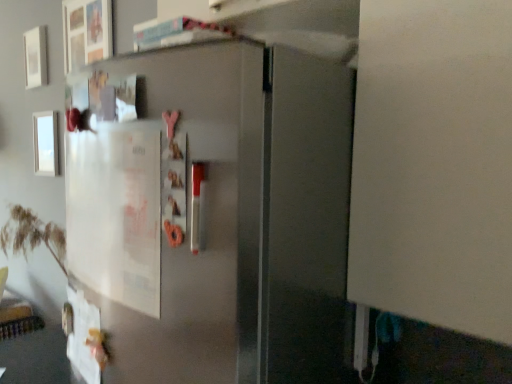
In order to click on white matte picture frame at upper left, positioned as the second picture frame in bottom-to-top order in this screenshot , I will do `click(35, 57)`.

Image resolution: width=512 pixels, height=384 pixels. What do you see at coordinates (35, 57) in the screenshot? I see `white matte picture frame at upper left, which appears as the 1th picture frame when viewed from the top` at bounding box center [35, 57].

What is the approximate width of white glossy picture frame at upper left, the first picture frame from the bottom?

The width of white glossy picture frame at upper left, the first picture frame from the bottom, is 1.33 inches.

At what (x,y) coordinates should I click in order to perform the action: click on white glossy picture frame at upper left, the first picture frame from the bottom. Please return your answer as a coordinate pair (x, y). Image resolution: width=512 pixels, height=384 pixels. Looking at the image, I should click on (45, 143).

Describe the element at coordinates (45, 143) in the screenshot. I see `white glossy picture frame at upper left, the first picture frame from the bottom` at that location.

Image resolution: width=512 pixels, height=384 pixels. Find the location of `white matte picture frame at upper left, positioned as the second picture frame in bottom-to-top order`. white matte picture frame at upper left, positioned as the second picture frame in bottom-to-top order is located at coordinates (35, 57).

Can you confirm if white matte picture frame at upper left, positioned as the second picture frame in bottom-to-top order, is positioned to the right of white glossy picture frame at upper left, the first picture frame from the bottom?

No, white matte picture frame at upper left, positioned as the second picture frame in bottom-to-top order, is not to the right of white glossy picture frame at upper left, the first picture frame from the bottom.

Which object is closer to the camera, white matte picture frame at upper left, positioned as the second picture frame in bottom-to-top order, or white glossy picture frame at upper left, the first picture frame from the bottom?

white glossy picture frame at upper left, the first picture frame from the bottom.

Considering the points (30, 84) and (55, 126), which point is in front, point (30, 84) or point (55, 126)?

The point (55, 126) is closer.

From the image's perspective, who appears lower, white matte picture frame at upper left, positioned as the second picture frame in bottom-to-top order, or white glossy picture frame at upper left, the first picture frame from the bottom?

white glossy picture frame at upper left, the first picture frame from the bottom, is shown below in the image.

From a real-world perspective, who is located higher, white matte picture frame at upper left, positioned as the second picture frame in bottom-to-top order, or white glossy picture frame at upper left, the first picture frame from the bottom?

white matte picture frame at upper left, positioned as the second picture frame in bottom-to-top order.

Can you confirm if white matte picture frame at upper left, positioned as the second picture frame in bottom-to-top order, is wider than white glossy picture frame at upper left, the first picture frame from the bottom?

Yes.

In terms of height, does white matte picture frame at upper left, positioned as the second picture frame in bottom-to-top order, look taller or shorter compared to white glossy picture frame at upper left, which appears as the second picture frame when viewed from the top?

In the image, white matte picture frame at upper left, positioned as the second picture frame in bottom-to-top order, appears to be shorter than white glossy picture frame at upper left, which appears as the second picture frame when viewed from the top.

Looking at this image, which of these two, white matte picture frame at upper left, which appears as the 1th picture frame when viewed from the top, or white glossy picture frame at upper left, which appears as the second picture frame when viewed from the top, is smaller?

Smaller between the two is white glossy picture frame at upper left, which appears as the second picture frame when viewed from the top.

Based on the photo, is white matte picture frame at upper left, positioned as the second picture frame in bottom-to-top order, inside or outside of white glossy picture frame at upper left, the first picture frame from the bottom?

white matte picture frame at upper left, positioned as the second picture frame in bottom-to-top order, is not enclosed by white glossy picture frame at upper left, the first picture frame from the bottom.

Are white matte picture frame at upper left, positioned as the second picture frame in bottom-to-top order, and white glossy picture frame at upper left, the first picture frame from the bottom, making contact?

No, white matte picture frame at upper left, positioned as the second picture frame in bottom-to-top order, is not in contact with white glossy picture frame at upper left, the first picture frame from the bottom.

Is white matte picture frame at upper left, positioned as the second picture frame in bottom-to-top order, looking in the opposite direction of white glossy picture frame at upper left, the first picture frame from the bottom?

That's not correct — white matte picture frame at upper left, positioned as the second picture frame in bottom-to-top order, is not looking away from white glossy picture frame at upper left, the first picture frame from the bottom.

Where is `picture frame that is below the white matte picture frame at upper left, which appears as the 1th picture frame when viewed from the top (from the image's perspective)`? The image size is (512, 384). picture frame that is below the white matte picture frame at upper left, which appears as the 1th picture frame when viewed from the top (from the image's perspective) is located at coordinates (45, 143).

In the image, is white glossy picture frame at upper left, which appears as the second picture frame when viewed from the top, on the left side or the right side of white matte picture frame at upper left, positioned as the second picture frame in bottom-to-top order?

white glossy picture frame at upper left, which appears as the second picture frame when viewed from the top, is positioned on white matte picture frame at upper left, positioned as the second picture frame in bottom-to-top order,'s right side.

Considering the positions of objects white glossy picture frame at upper left, which appears as the second picture frame when viewed from the top, and white matte picture frame at upper left, which appears as the 1th picture frame when viewed from the top, in the image provided, who is behind, white glossy picture frame at upper left, which appears as the second picture frame when viewed from the top, or white matte picture frame at upper left, which appears as the 1th picture frame when viewed from the top,?

white matte picture frame at upper left, which appears as the 1th picture frame when viewed from the top, is further from the camera.

Is point (41, 122) positioned before point (28, 40)?

That is False.

From the image's perspective, which one is positioned higher, white glossy picture frame at upper left, which appears as the second picture frame when viewed from the top, or white matte picture frame at upper left, positioned as the second picture frame in bottom-to-top order?

white matte picture frame at upper left, positioned as the second picture frame in bottom-to-top order, is shown above in the image.

From a real-world perspective, is white glossy picture frame at upper left, which appears as the second picture frame when viewed from the top, beneath white matte picture frame at upper left, positioned as the second picture frame in bottom-to-top order?

Yes, from a real-world perspective, white glossy picture frame at upper left, which appears as the second picture frame when viewed from the top, is under white matte picture frame at upper left, positioned as the second picture frame in bottom-to-top order.

Is white glossy picture frame at upper left, which appears as the second picture frame when viewed from the top, wider than white matte picture frame at upper left, positioned as the second picture frame in bottom-to-top order?

Incorrect, the width of white glossy picture frame at upper left, which appears as the second picture frame when viewed from the top, does not surpass that of white matte picture frame at upper left, positioned as the second picture frame in bottom-to-top order.

Is white glossy picture frame at upper left, which appears as the second picture frame when viewed from the top, shorter than white matte picture frame at upper left, positioned as the second picture frame in bottom-to-top order?

No.

Considering the sizes of objects white glossy picture frame at upper left, the first picture frame from the bottom, and white matte picture frame at upper left, which appears as the 1th picture frame when viewed from the top, in the image provided, who is bigger, white glossy picture frame at upper left, the first picture frame from the bottom, or white matte picture frame at upper left, which appears as the 1th picture frame when viewed from the top,?

white matte picture frame at upper left, which appears as the 1th picture frame when viewed from the top, is bigger.

Is white glossy picture frame at upper left, which appears as the second picture frame when viewed from the top, located outside white matte picture frame at upper left, positioned as the second picture frame in bottom-to-top order?

white glossy picture frame at upper left, which appears as the second picture frame when viewed from the top, is positioned outside white matte picture frame at upper left, positioned as the second picture frame in bottom-to-top order.

Are white glossy picture frame at upper left, which appears as the second picture frame when viewed from the top, and white matte picture frame at upper left, positioned as the second picture frame in bottom-to-top order, located far from each other?

No, there isn't a large distance between white glossy picture frame at upper left, which appears as the second picture frame when viewed from the top, and white matte picture frame at upper left, positioned as the second picture frame in bottom-to-top order.

Is white glossy picture frame at upper left, which appears as the second picture frame when viewed from the top, turned away from white matte picture frame at upper left, which appears as the 1th picture frame when viewed from the top?

No, white glossy picture frame at upper left, which appears as the second picture frame when viewed from the top,'s orientation is not away from white matte picture frame at upper left, which appears as the 1th picture frame when viewed from the top.

Can you tell me how much white glossy picture frame at upper left, the first picture frame from the bottom, and white matte picture frame at upper left, which appears as the 1th picture frame when viewed from the top, differ in facing direction?

There is a 4.17-degree angle between the facing directions of white glossy picture frame at upper left, the first picture frame from the bottom, and white matte picture frame at upper left, which appears as the 1th picture frame when viewed from the top.

This screenshot has width=512, height=384. In order to click on picture frame located underneath the white matte picture frame at upper left, positioned as the second picture frame in bottom-to-top order (from a real-world perspective) in this screenshot , I will do `click(45, 143)`.

Where is `picture frame that appears below the white matte picture frame at upper left, positioned as the second picture frame in bottom-to-top order (from a real-world perspective)`? This screenshot has height=384, width=512. picture frame that appears below the white matte picture frame at upper left, positioned as the second picture frame in bottom-to-top order (from a real-world perspective) is located at coordinates (45, 143).

Image resolution: width=512 pixels, height=384 pixels. Identify the location of picture frame lying on the left of white glossy picture frame at upper left, the first picture frame from the bottom. (35, 57).